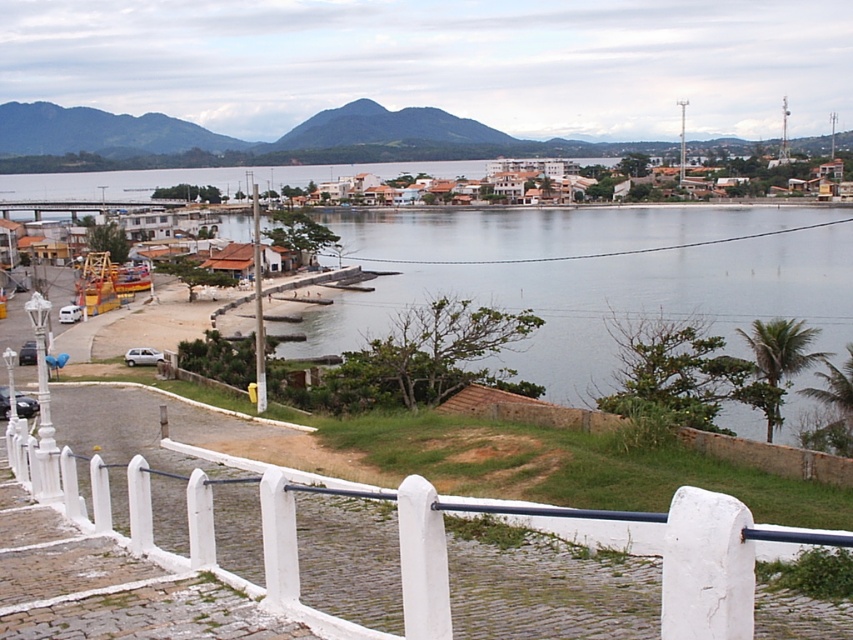
Question: Can you confirm if clear water at center is positioned below white painted wood fence at lower center?

Choices:
 (A) no
 (B) yes

Answer: (A)

Question: Which of the following is the closest to the observer?

Choices:
 (A) (502, 198)
 (B) (132, 525)
 (C) (741, 326)

Answer: (B)

Question: Which object is farther from the camera taking this photo?

Choices:
 (A) white painted wood fence at lower center
 (B) clear water at center
 (C) white textured buildings at center

Answer: (C)

Question: Based on their relative distances, which object is nearer to the clear water at center?

Choices:
 (A) white painted wood fence at lower center
 (B) white textured buildings at center

Answer: (B)

Question: Observing the image, what is the correct spatial positioning of clear water at center in reference to white painted wood fence at lower center?

Choices:
 (A) right
 (B) left

Answer: (A)

Question: Can you confirm if clear water at center is smaller than white textured buildings at center?

Choices:
 (A) no
 (B) yes

Answer: (A)